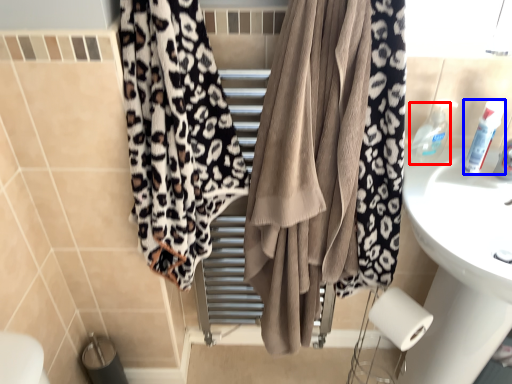
Question: Which of the following is the closest to the observer, toiletry (highlighted by a red box) or toiletry (highlighted by a blue box)?

Choices:
 (A) toiletry
 (B) toiletry

Answer: (B)